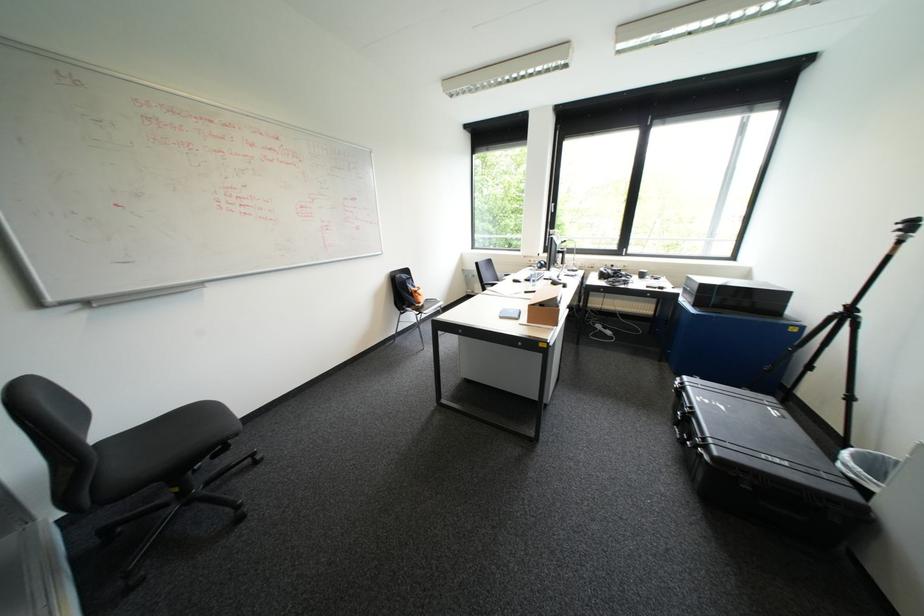
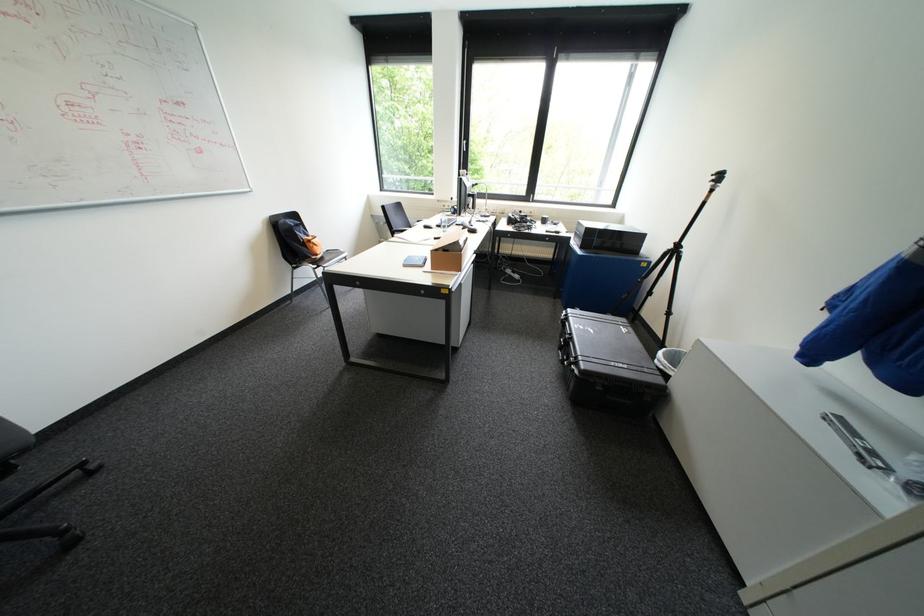
In the second image, find the point that corresponds to point (419, 288) in the first image.

(310, 237)